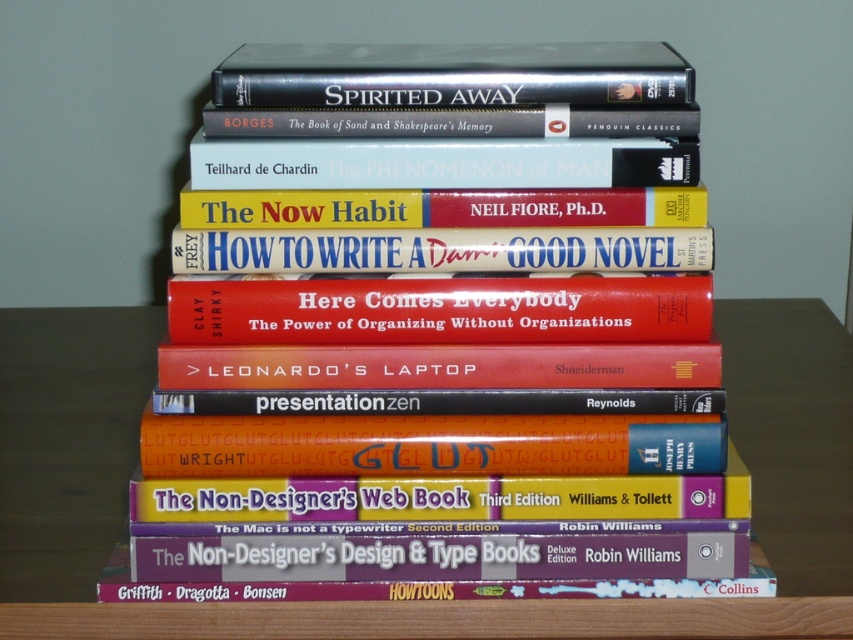
In the scene shown: You are organizing books on a shelf and need to place a new book between the red matte book at center and the hardcover book at center. Which book should you place the new book in front of or behind?

You should place the new book behind the red matte book at center because it is closer to the viewer than the hardcover book at center, meaning the hardcover book is further back.

Based on the photo, you are organizing a bookshelf and see the wooden table at center and the matte red book at center. Which object is closer to you?

The wooden table at center is closer to you because the matte red book at center is behind it.

You are standing in front of the neatly stacked books and notice the wooden table at center and the matte red book at center. Which object is positioned to the right of the other?

The wooden table at center is to the right of the matte red book at center.